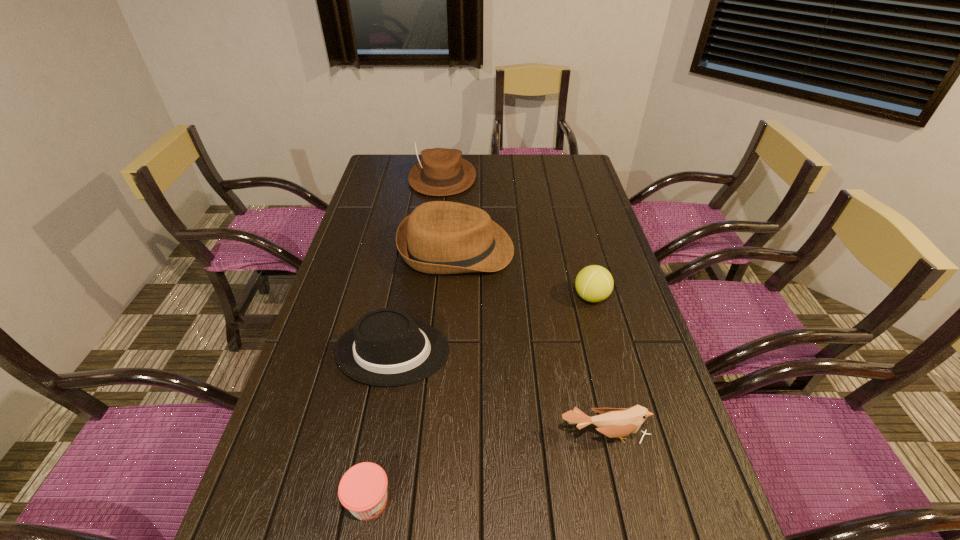
Find the location of a particular element. object that can be found as the third closest to the bird is located at coordinates (594, 283).

Select which object appears as the second closest to the shortest object. Please provide its 2D coordinates. Your answer should be formatted as a tuple, i.e. [(x, y)], where the tuple contains the x and y coordinates of a point satisfying the conditions above.

[(612, 422)]

Locate which fedora ranks in proximity to the bird. Please provide its 2D coordinates. Your answer should be formatted as a tuple, i.e. [(x, y)], where the tuple contains the x and y coordinates of a point satisfying the conditions above.

[(387, 347)]

Identify which fedora is located as the third nearest to the fifth farthest object. Please provide its 2D coordinates. Your answer should be formatted as a tuple, i.e. [(x, y)], where the tuple contains the x and y coordinates of a point satisfying the conditions above.

[(442, 172)]

Identify the location of free space that satisfies the following two spatial constraints: 1. on the front side of the fourth nearest object; 2. on the front-facing side of the nearest fedora. (606, 352).

Find the location of a particular element. blank area in the image that satisfies the following two spatial constraints: 1. on the feather side of the farthest object; 2. on the front label of the shortest object is located at coordinates (402, 501).

Identify the location of free location that satisfies the following two spatial constraints: 1. on the feather side of the farthest object; 2. on the front label of the nearest object. (402, 501).

This screenshot has width=960, height=540. I want to click on free space in the image that satisfies the following two spatial constraints: 1. at the beak of the second nearest object; 2. on the front label of the nearest object, so click(619, 501).

Where is `vacant region that satisfies the following two spatial constraints: 1. at the beak of the bird; 2. on the front label of the jam`? Image resolution: width=960 pixels, height=540 pixels. vacant region that satisfies the following two spatial constraints: 1. at the beak of the bird; 2. on the front label of the jam is located at coordinates (619, 501).